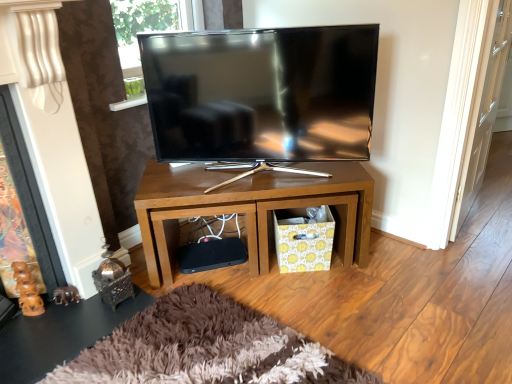
The width and height of the screenshot is (512, 384). I want to click on vacant point to the right of yellow floral cardboard crate at lower center, so click(x=354, y=272).